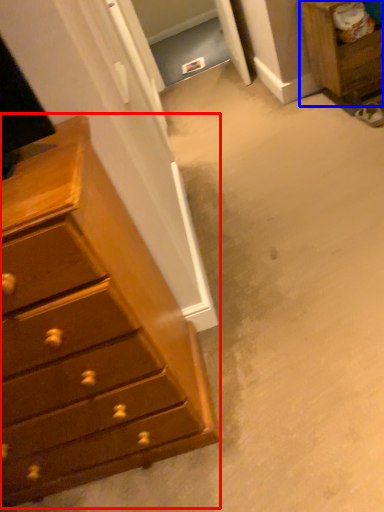
Question: Which object is closer to the camera taking this photo, chest of drawers (highlighted by a red box) or nightstand (highlighted by a blue box)?

Choices:
 (A) chest of drawers
 (B) nightstand

Answer: (A)